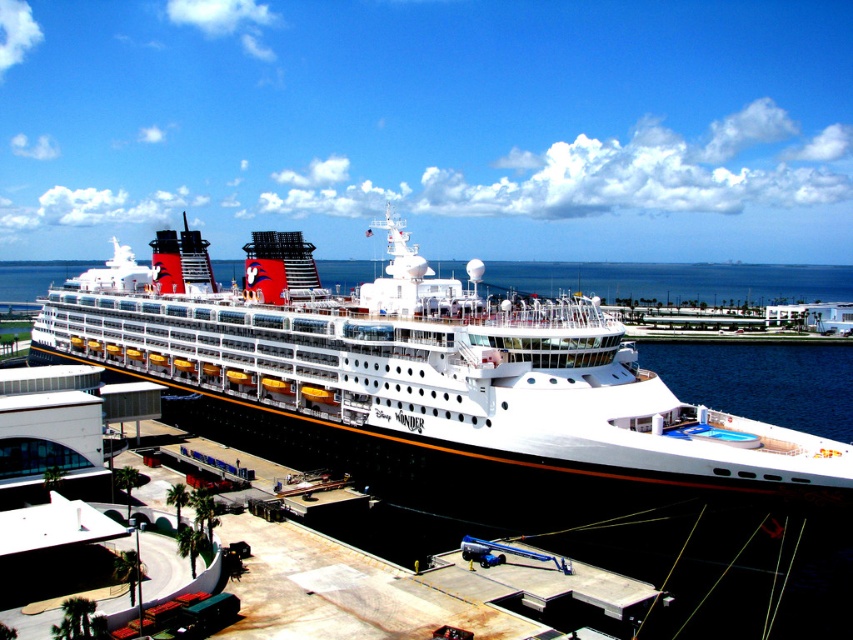
Question: Which point is closer to the camera?

Choices:
 (A) (x=572, y=296)
 (B) (x=525, y=260)

Answer: (A)

Question: Among these objects, which one is farthest from the camera?

Choices:
 (A) white glossy cruise ship at center
 (B) blue water at center

Answer: (B)

Question: Does white glossy cruise ship at center appear under blue water at center?

Choices:
 (A) no
 (B) yes

Answer: (B)

Question: Is white glossy cruise ship at center to the left of blue water at center from the viewer's perspective?

Choices:
 (A) no
 (B) yes

Answer: (B)

Question: Does white glossy cruise ship at center have a larger size compared to blue water at center?

Choices:
 (A) no
 (B) yes

Answer: (B)